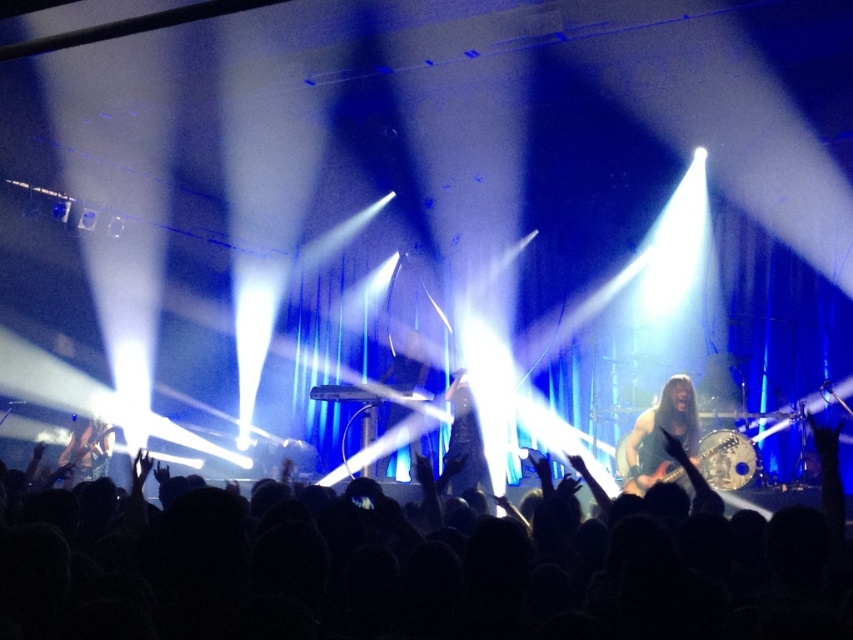
In the scene shown: Can you confirm if black hair at center is taller than black leather jacket at center?

Incorrect, black hair at center's height is not larger of black leather jacket at center's.

Is point (552, 493) positioned after point (469, 440)?

No, (552, 493) is in front of (469, 440).

Where is `black hair at center`? The image size is (853, 640). black hair at center is located at coordinates (431, 572).

Does black leather jacket at center have a larger size compared to shiny black guitar at left?

Incorrect, black leather jacket at center is not larger than shiny black guitar at left.

Based on the photo, is black leather jacket at center behind shiny black guitar at left?

No, black leather jacket at center is in front of shiny black guitar at left.

Between point (453, 403) and point (91, 429), which one is positioned behind?

Point (91, 429)

Where is `black leather jacket at center`? black leather jacket at center is located at coordinates (465, 442).

Is black hair at center positioned at the back of shiny black guitar at left?

No, it is in front of shiny black guitar at left.

Is point (607, 518) positioned in front of point (102, 428)?

Yes, point (607, 518) is closer to viewer.

The image size is (853, 640). I want to click on black hair at center, so click(431, 572).